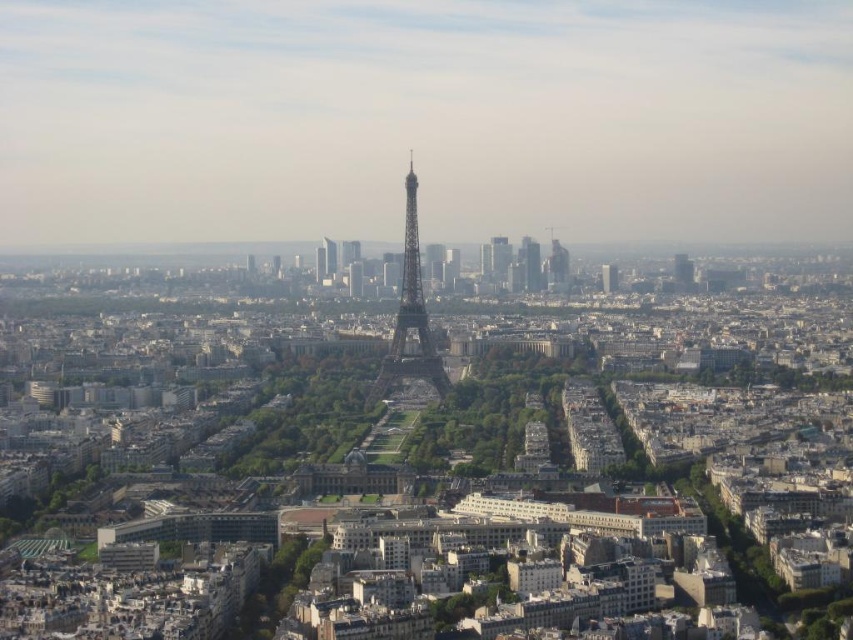
Question: Does metallic silver eiffel tower at center come in front of glassy reflective skyscraper at center?

Choices:
 (A) yes
 (B) no

Answer: (A)

Question: Is metallic silver eiffel tower at center positioned before shiny silver tower at center?

Choices:
 (A) yes
 (B) no

Answer: (A)

Question: From the image, what is the correct spatial relationship of glassy reflective skyscraper at center in relation to shiny silver tower at center?

Choices:
 (A) left
 (B) right

Answer: (B)

Question: Which point is farther to the camera?

Choices:
 (A) shiny silver tower at center
 (B) metallic silver eiffel tower at center
 (C) glassy reflective skyscraper at center-right
 (D) glassy reflective skyscraper at center

Answer: (A)

Question: Which object is closer to the camera taking this photo?

Choices:
 (A) glassy reflective skyscraper at center-right
 (B) shiny silver tower at center

Answer: (A)

Question: Which of the following is the closest to the observer?

Choices:
 (A) glassy reflective skyscraper at center
 (B) metallic silver eiffel tower at center

Answer: (B)